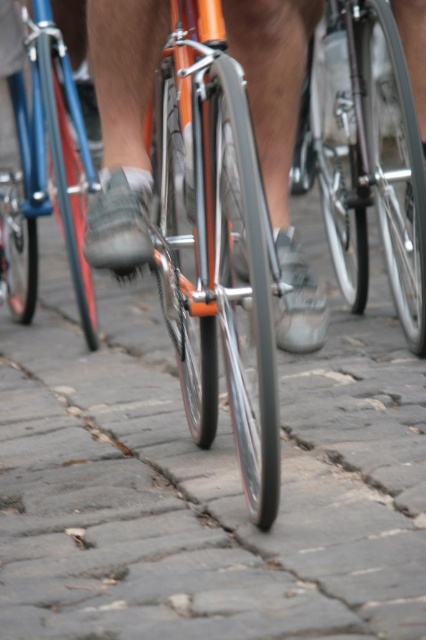
Between shiny orange frame at center and shiny blue frame at center, which one appears on the left side from the viewer's perspective?

From the viewer's perspective, shiny blue frame at center appears more on the left side.

Who is shorter, shiny orange frame at center or shiny blue frame at center?

shiny orange frame at center

Between point (203, 61) and point (92, 339), which one is positioned behind?

The point (92, 339) is behind.

At what (x,y) coordinates should I click in order to perform the action: click on shiny orange frame at center. Please return your answer as a coordinate pair (x, y). Looking at the image, I should click on (218, 250).

Who is taller, shiny orange frame at center or shiny silver bicycle at center?

shiny silver bicycle at center

Who is positioned more to the right, shiny orange frame at center or shiny silver bicycle at center?

shiny silver bicycle at center is more to the right.

Locate an element on the screen. The height and width of the screenshot is (640, 426). shiny orange frame at center is located at coordinates (218, 250).

In order to click on shiny orange frame at center in this screenshot , I will do `click(218, 250)`.

Is shiny silver bicycle at center bigger than shiny blue frame at center?

Yes.

Between point (324, 131) and point (72, 154), which one is positioned in front?

Positioned in front is point (324, 131).

Where is `shiny silver bicycle at center`? The image size is (426, 640). shiny silver bicycle at center is located at coordinates (365, 156).